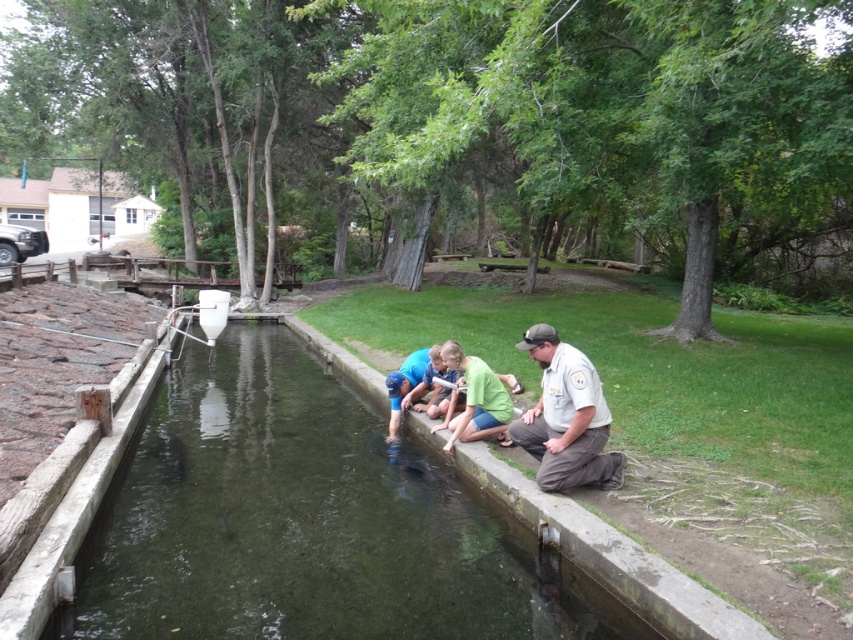
Who is shorter, clear concrete water at center or green cotton shirt at center?

Standing shorter between the two is clear concrete water at center.

Is clear concrete water at center taller than green cotton shirt at center?

No.

Where is `clear concrete water at center`? The image size is (853, 640). clear concrete water at center is located at coordinates (306, 522).

Is point (509, 400) in front of point (397, 435)?

Yes, it is in front of point (397, 435).

Between point (494, 388) and point (392, 376), which one is positioned in front?

Point (494, 388)

At what (x,y) coordinates should I click in order to perform the action: click on green cotton shirt at center. Please return your answer as a coordinate pair (x, y). The image size is (853, 640). Looking at the image, I should click on (476, 400).

Does khaki uniform at center appear under green cotton shirt at center?

Actually, khaki uniform at center is above green cotton shirt at center.

Is khaki uniform at center thinner than green cotton shirt at center?

No, khaki uniform at center is not thinner than green cotton shirt at center.

The image size is (853, 640). In order to click on khaki uniform at center in this screenshot , I will do `click(566, 417)`.